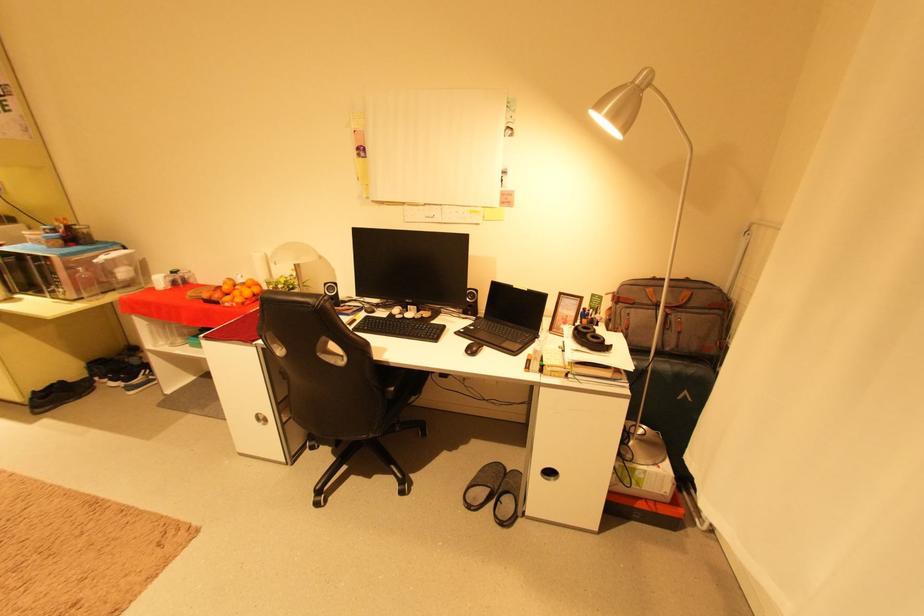
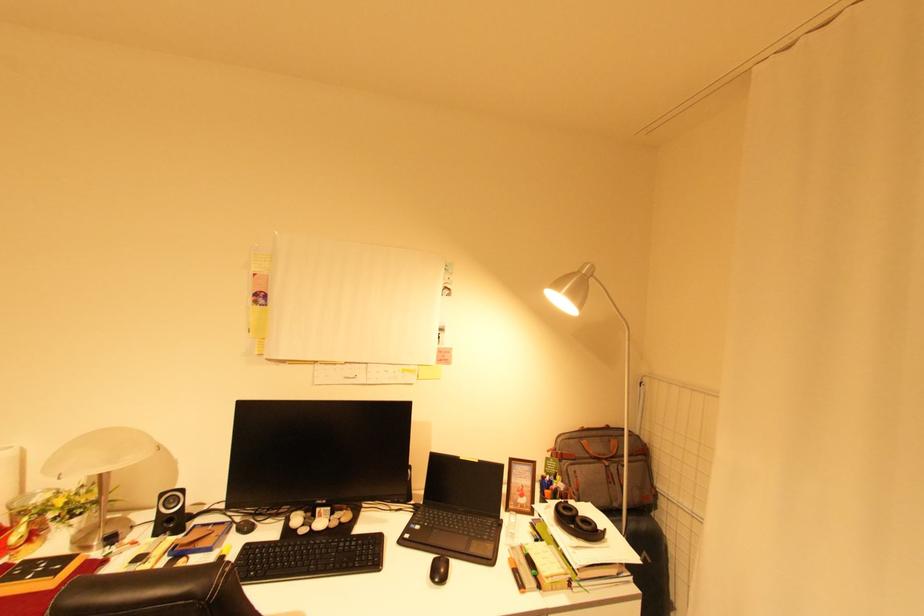
Where in the second image is the point corresponding to [478,342] from the first image?

(441, 559)